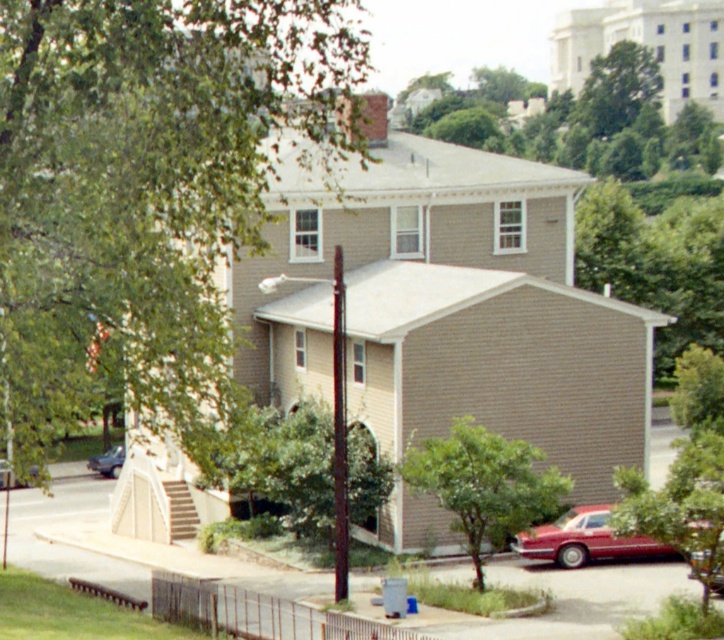
Who is lower down, green leafy tree at upper center or metallic red car at lower right?

metallic red car at lower right is lower down.

Is green leafy tree at upper center to the right of metallic red car at lower right from the viewer's perspective?

Yes, green leafy tree at upper center is to the right of metallic red car at lower right.

Which is behind, point (683, 148) or point (12, 481)?

Positioned behind is point (683, 148).

You are a GUI agent. You are given a task and a screenshot of the screen. Output one action in this format:
    pyautogui.click(x=<x>, y=<y>)
    Task: Click on the green leafy tree at upper center
    
    Given the screenshot: What is the action you would take?
    pyautogui.click(x=584, y=120)

How distant is green leafy tree at lower right from metallic red car at lower right?

green leafy tree at lower right and metallic red car at lower right are 49.59 feet apart from each other.

Is green leafy tree at lower right smaller than metallic red car at lower right?

Indeed, green leafy tree at lower right has a smaller size compared to metallic red car at lower right.

The image size is (724, 640). I want to click on green leafy tree at lower right, so click(x=678, y=504).

Is green leafy tree at upper left behind green leafy tree at lower right?

That is False.

Can you confirm if green leafy tree at upper left is positioned to the left of green leafy tree at lower right?

Indeed, green leafy tree at upper left is positioned on the left side of green leafy tree at lower right.

The width and height of the screenshot is (724, 640). In order to click on green leafy tree at upper left in this screenshot , I will do `click(143, 195)`.